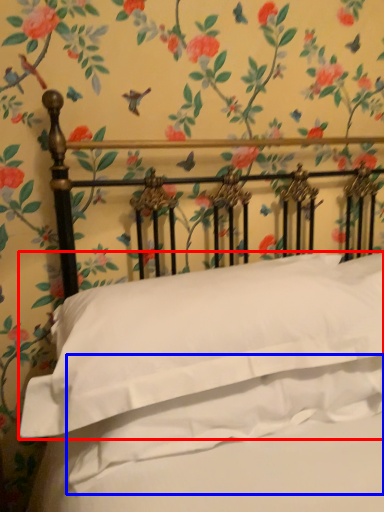
Question: Among these objects, which one is nearest to the camera, pillow (highlighted by a red box) or sheet (highlighted by a blue box)?

Choices:
 (A) pillow
 (B) sheet

Answer: (A)